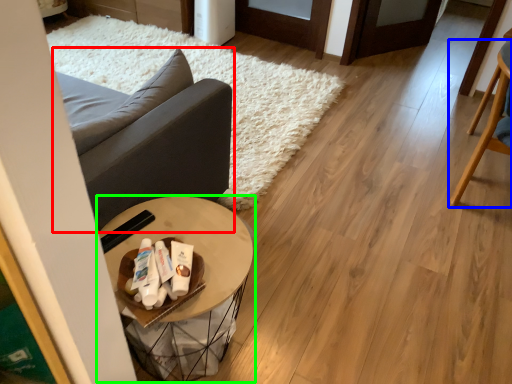
Question: Which is farther away from studio couch (highlighted by a red box)? chair (highlighted by a blue box) or table (highlighted by a green box)?

Choices:
 (A) chair
 (B) table

Answer: (A)